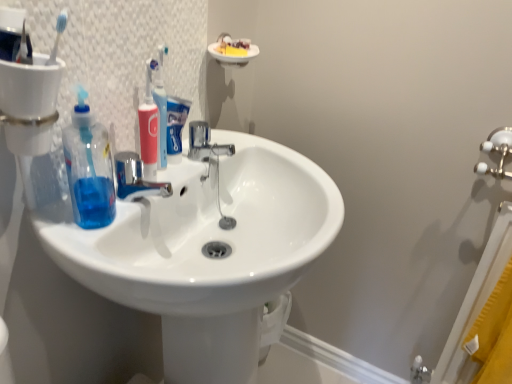
Question: Considering their positions, is transparent blue liquid at sink left located in front of or behind chrome metallic faucet at center?

Choices:
 (A) behind
 (B) front

Answer: (B)

Question: Based on their positions, is transparent blue liquid at sink left located to the left or right of chrome metallic faucet at center?

Choices:
 (A) left
 (B) right

Answer: (A)

Question: Which object is positioned closest to the white glossy sink at center?

Choices:
 (A) chrome metallic faucet at center
 (B) blue matte toothpaste at center
 (C) pink plastic toothbrush at center
 (D) transparent plastic toothbrushes at upper left
 (E) transparent blue liquid at sink left

Answer: (E)

Question: Estimate the real-world distances between objects in this image. Which object is closer to the transparent blue liquid at sink left?

Choices:
 (A) chrome metallic faucet at center
 (B) blue matte toothpaste at center
 (C) white glossy sink at center
 (D) pink plastic toothbrush at center
 (E) transparent plastic toothbrushes at upper left

Answer: (D)